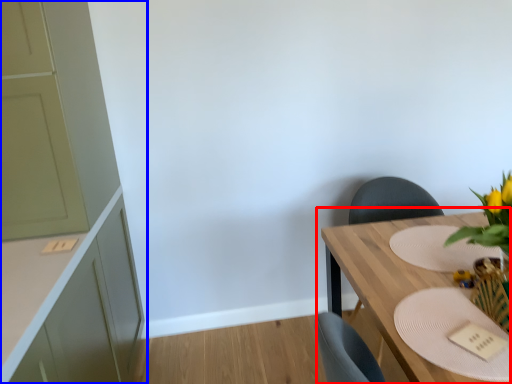
Question: Which object is closer to the camera taking this photo, table (highlighted by a red box) or cabinetry (highlighted by a blue box)?

Choices:
 (A) table
 (B) cabinetry

Answer: (A)